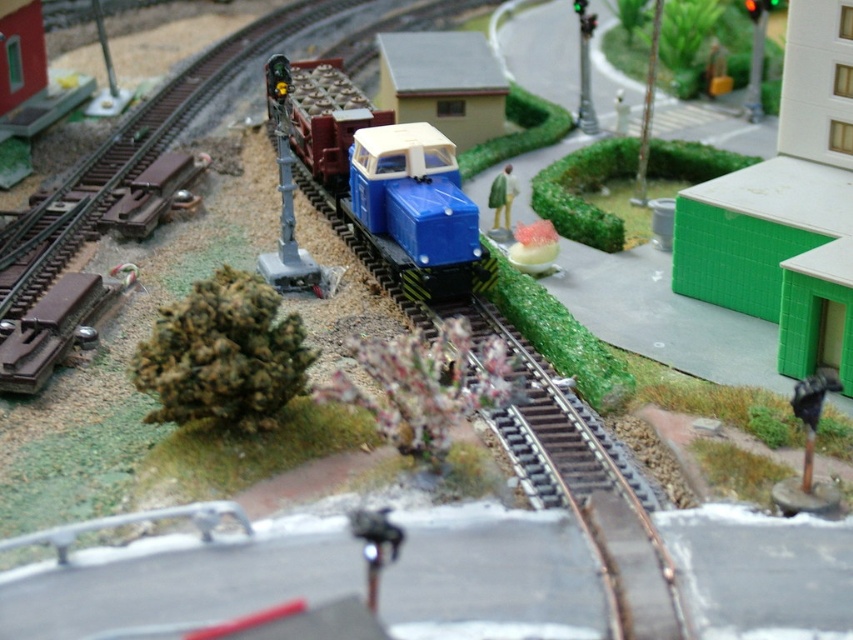
Question: Which object is the farthest from the blue plastic train at center?

Choices:
 (A) blue plastic train car at center
 (B) green matte figure at center

Answer: (B)

Question: Is blue plastic train at center below green matte figure at center?

Choices:
 (A) no
 (B) yes

Answer: (A)

Question: Which object is the closest to the green matte figure at center?

Choices:
 (A) blue plastic train at center
 (B) metallic gray signal light at upper left
 (C) blue plastic train car at center

Answer: (C)

Question: Among these objects, which one is nearest to the camera?

Choices:
 (A) blue plastic train at center
 (B) green matte figure at center
 (C) blue plastic train car at center
 (D) metallic gray signal light at upper left

Answer: (D)

Question: Is blue plastic train car at center above green matte figure at center?

Choices:
 (A) yes
 (B) no

Answer: (B)

Question: Does blue plastic train car at center appear on the right side of metallic gray signal light at upper left?

Choices:
 (A) yes
 (B) no

Answer: (A)